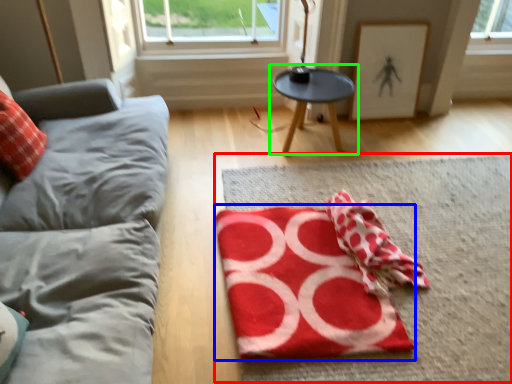
Question: Estimate the real-world distances between objects in this image. Which object is farther from mat (highlighted by a red box), yoga mat (highlighted by a blue box) or table (highlighted by a green box)?

Choices:
 (A) yoga mat
 (B) table

Answer: (B)